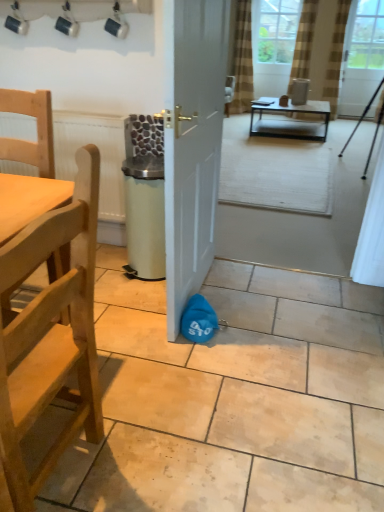
Where is `vacant space situated on the left part of white glossy door at center`? The height and width of the screenshot is (512, 384). vacant space situated on the left part of white glossy door at center is located at coordinates (128, 297).